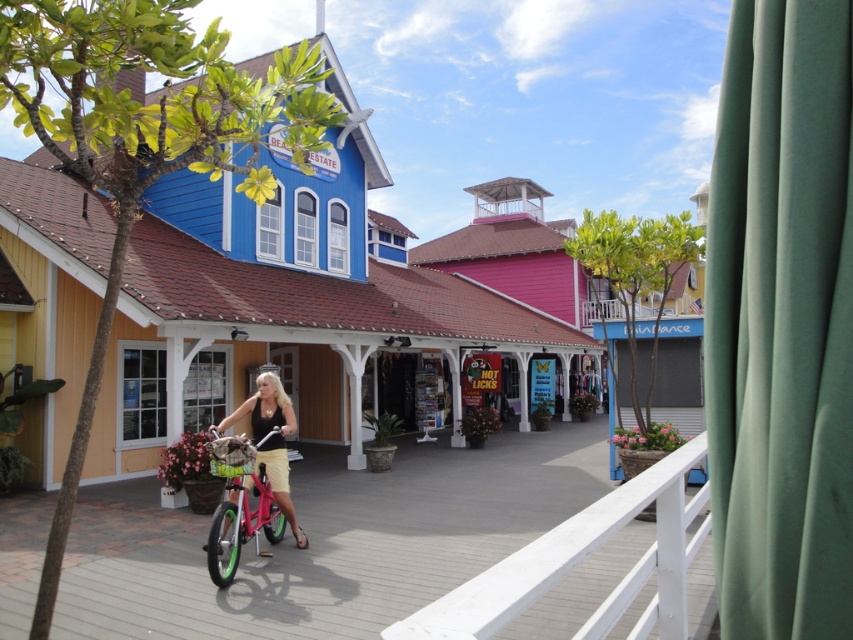
Question: Which of the following is the farthest from the observer?

Choices:
 (A) (683, 600)
 (B) (282, 500)

Answer: (B)

Question: Is white wooden rail at center further to camera compared to matte black tank top at center?

Choices:
 (A) no
 (B) yes

Answer: (A)

Question: Among these objects, which one is farthest from the camera?

Choices:
 (A) matte black tank top at center
 (B) white wooden rail at center

Answer: (A)

Question: Is white wooden rail at center to the right of matte black tank top at center from the viewer's perspective?

Choices:
 (A) no
 (B) yes

Answer: (B)

Question: Which point is closer to the camera?

Choices:
 (A) matte black tank top at center
 (B) white wooden rail at center

Answer: (B)

Question: Does white wooden rail at center have a smaller size compared to matte black tank top at center?

Choices:
 (A) yes
 (B) no

Answer: (A)